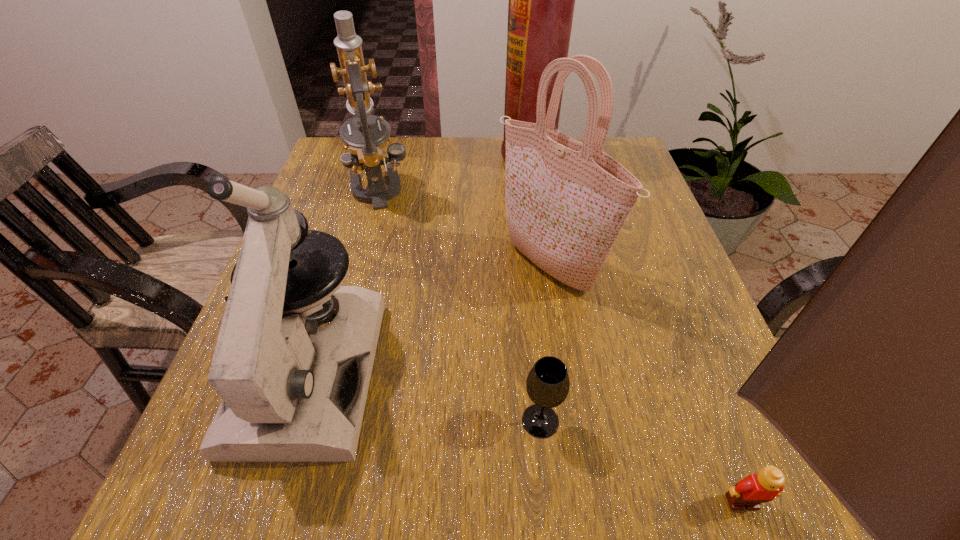
At what (x,y) coordinates should I click in order to perform the action: click on empty space that is in between the nearer microscope and the shopping bag. Please return your answer as a coordinate pair (x, y). This screenshot has height=540, width=960. Looking at the image, I should click on (430, 318).

This screenshot has height=540, width=960. Find the location of `blank region between the rightmost object and the nearer microscope`. blank region between the rightmost object and the nearer microscope is located at coordinates (526, 436).

Locate an element on the screen. The height and width of the screenshot is (540, 960). empty location between the shortest object and the nearer microscope is located at coordinates (526, 436).

Find the location of a particular element. This screenshot has width=960, height=540. unoccupied area between the shopping bag and the shortest object is located at coordinates (646, 384).

Locate an element on the screen. This screenshot has height=540, width=960. free space between the shopping bag and the nearer microscope is located at coordinates (430, 318).

Find the location of a particular element. The width and height of the screenshot is (960, 540). vacant area that lies between the farther microscope and the shopping bag is located at coordinates (464, 228).

Image resolution: width=960 pixels, height=540 pixels. What are the coordinates of `object that is the nearest to the rightmost object` in the screenshot? It's located at (547, 384).

Find the location of a particular element. This screenshot has height=540, width=960. object that stands as the closest to the tallest object is located at coordinates (566, 202).

Where is `vacant region that satisfies the following two spatial constraints: 1. on the side of the tallest object with the label; 2. on the front side of the second shortest object`? This screenshot has height=540, width=960. vacant region that satisfies the following two spatial constraints: 1. on the side of the tallest object with the label; 2. on the front side of the second shortest object is located at coordinates (571, 421).

I want to click on vacant space that satisfies the following two spatial constraints: 1. on the side of the fire extinguisher with the label; 2. on the front side of the farther microscope, so click(537, 189).